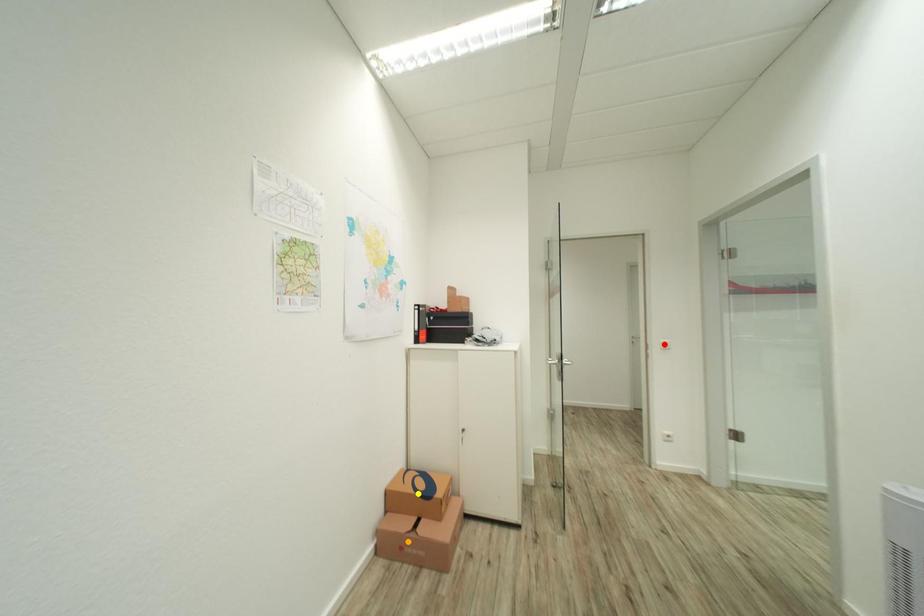
Order these from nearest to farthest:
red point
orange point
yellow point

orange point < yellow point < red point